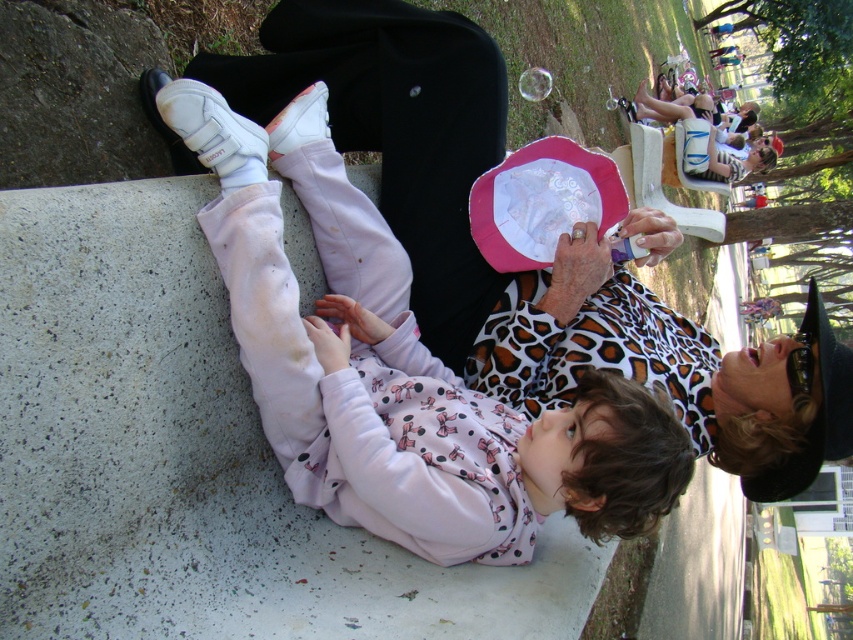
From the picture: Is pink fleece sweatshirt at lower center bigger than pink fabric paper plate at center?

Correct, pink fleece sweatshirt at lower center is larger in size than pink fabric paper plate at center.

Where is `pink fleece sweatshirt at lower center`? pink fleece sweatshirt at lower center is located at coordinates (401, 372).

Locate an element on the screen. pink fleece sweatshirt at lower center is located at coordinates 401,372.